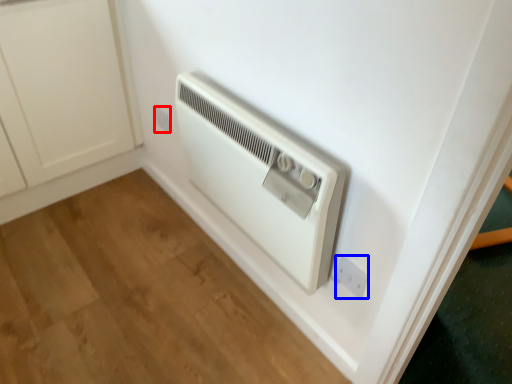
Question: Which point is closer to the camera, electric outlet (highlighted by a red box) or electric outlet (highlighted by a blue box)?

Choices:
 (A) electric outlet
 (B) electric outlet

Answer: (B)